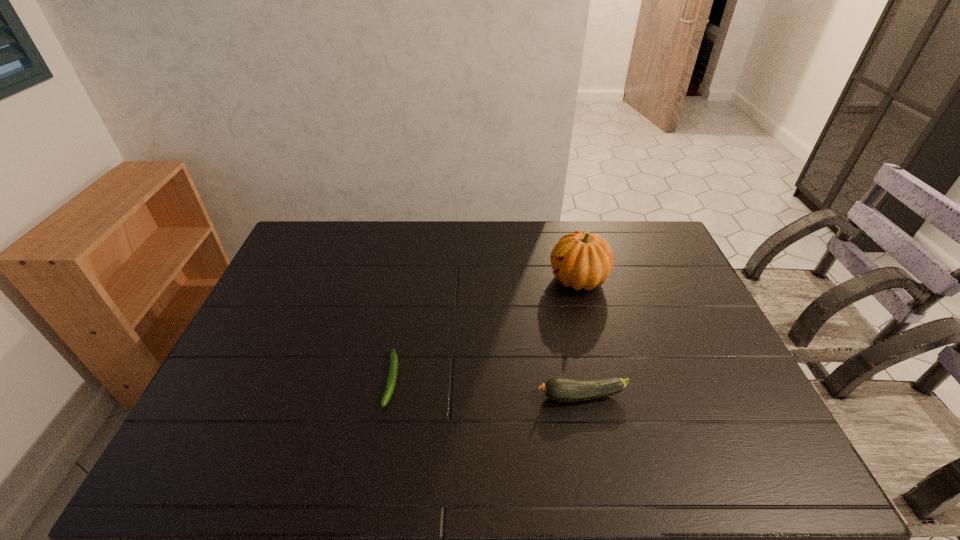
The image size is (960, 540). In order to click on free space located 0.250m at the blossom end of the second shortest object in this screenshot , I will do `click(439, 396)`.

Locate an element on the screen. free region located 0.310m at the blossom end of the second shortest object is located at coordinates point(416,396).

In the image, there is a desktop. Identify the location of blank space at the far edge. (362, 260).

This screenshot has height=540, width=960. In order to click on vacant space at the near edge of the desktop in this screenshot , I will do (x=467, y=449).

Find the location of a particular element. Image resolution: width=960 pixels, height=540 pixels. free space at the left edge of the desktop is located at coordinates (239, 364).

The height and width of the screenshot is (540, 960). Identify the location of vacant space at the right edge of the desktop. (641, 266).

You are a GUI agent. You are given a task and a screenshot of the screen. Output one action in this format:
    pyautogui.click(x=<x>, y=<y>)
    Task: Click on the free spot at the far left corner of the desktop
    
    Given the screenshot: What is the action you would take?
    pyautogui.click(x=320, y=225)

You are a GUI agent. You are given a task and a screenshot of the screen. Output one action in this format:
    pyautogui.click(x=<x>, y=<y>)
    Task: Click on the free area in between the farthest object and the second tallest object
    The height and width of the screenshot is (540, 960).
    Given the screenshot: What is the action you would take?
    pyautogui.click(x=580, y=338)

The image size is (960, 540). I want to click on vacant area between the second shortest object and the tallest object, so click(580, 338).

Locate an element on the screen. The width and height of the screenshot is (960, 540). free spot between the leftmost object and the farthest object is located at coordinates (485, 329).